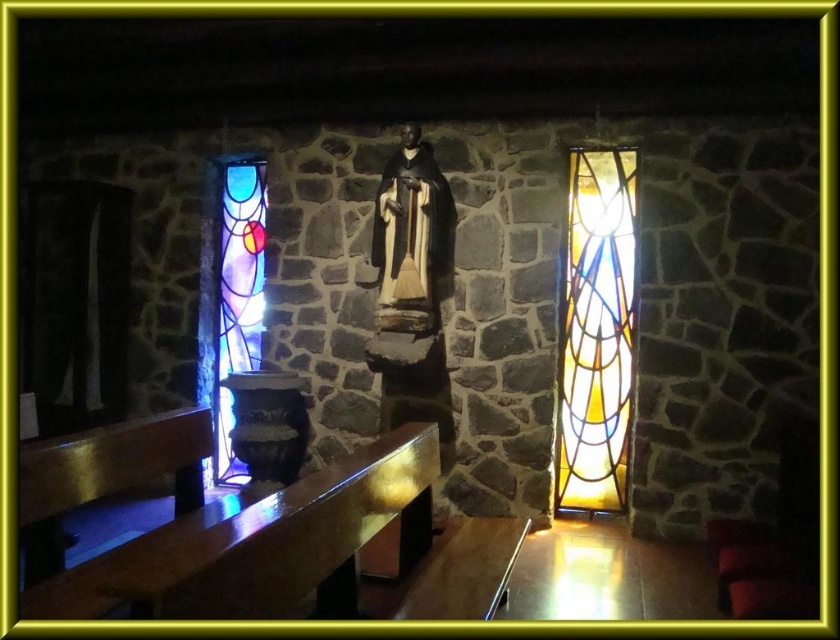
You are a visitor entering the chapel and want to sit down. You see the polished wood bench at lower left and the translucent stained glass at right. Which object is lower in height?

The polished wood bench at lower left is shorter than the translucent stained glass at right, so the bench is lower in height.

You are standing in the chapel and want to locate the translucent stained glass at right. According to the coordinates provided, where exactly should you look to find it?

The translucent stained glass at right is located at the coordinates point (x=596, y=332).

You are an interior designer planning to install a new lighting fixture. You have two options based on the existing stained glass windows. The translucent stained glass at right and the stained glass window at left are both candidates. Which of these two has a shorter height?

The translucent stained glass at right has a lesser height compared to the stained glass window at left, so the translucent stained glass at right is shorter in height.